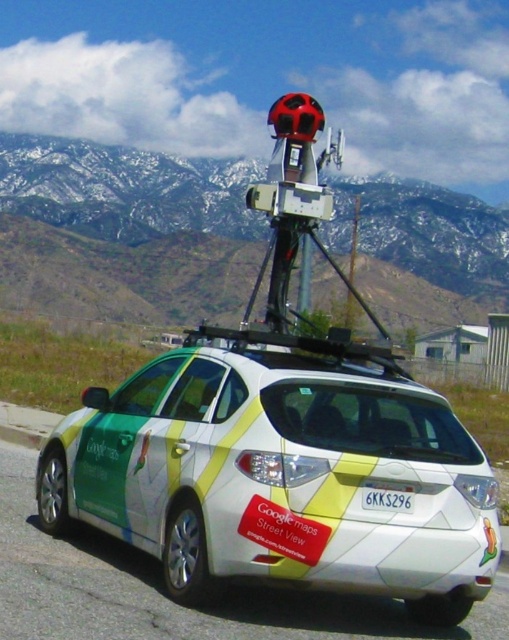
You are a photographer trying to capture a clear photo of the white plastic license plate at rear. However, the white glossy car at center is blocking your view. Can you suggest a way to adjust your position to avoid the obstruction?

The white glossy car at center is positioned over the white plastic license plate at rear, so moving to the side or behind the car would allow you to see the license plate without obstruction.

Looking at the Google Street View car, where is the snowy rock mountain at upper center in relation to the white plastic license plate at rear?

The snowy rock mountain at upper center is located to the left of the white plastic license plate at rear.

You are standing in front of the Google Street View car and notice two points marked on its roof. The first point is at coordinates point [166,202] and the second point is at point [392,492]. Which point appears closer to your viewpoint?

Point [392,492] appears closer to your viewpoint because it is closer to the camera than point [166,202].